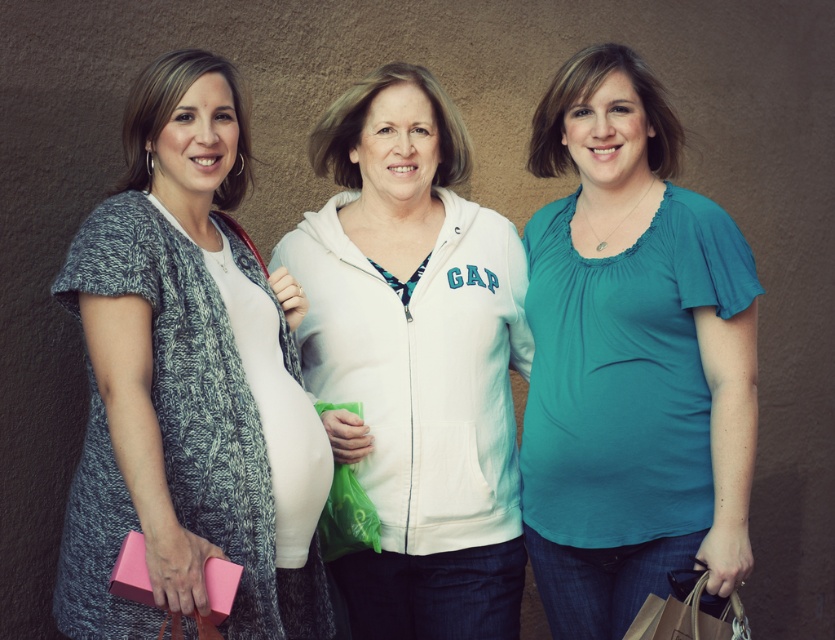
Question: In this image, where is knitted gray cardigan at left located relative to brown paper bag at lower right?

Choices:
 (A) below
 (B) above

Answer: (B)

Question: Which point appears farthest from the camera in this image?

Choices:
 (A) (149, 465)
 (B) (658, 596)
 (C) (424, 346)
 (D) (697, 484)

Answer: (C)

Question: Which object is positioned closest to the white cotton zip-up hoodie at center?

Choices:
 (A) brown paper bag at lower right
 (B) teal matte shirt at center
 (C) knitted gray cardigan at left

Answer: (B)

Question: Observing the image, what is the correct spatial positioning of teal matte shirt at center in reference to white cotton zip-up hoodie at center?

Choices:
 (A) below
 (B) above

Answer: (B)

Question: Which of these objects is positioned closest to the knitted gray cardigan at left?

Choices:
 (A) brown paper bag at lower right
 (B) teal matte shirt at center
 (C) white cotton zip-up hoodie at center

Answer: (C)

Question: Is the position of knitted gray cardigan at left less distant than that of teal matte shirt at center?

Choices:
 (A) yes
 (B) no

Answer: (A)